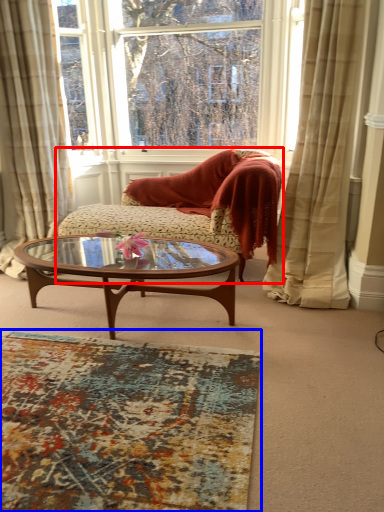
Question: Which point is closer to the camera, studio couch (highlighted by a red box) or plain (highlighted by a blue box)?

Choices:
 (A) studio couch
 (B) plain

Answer: (B)